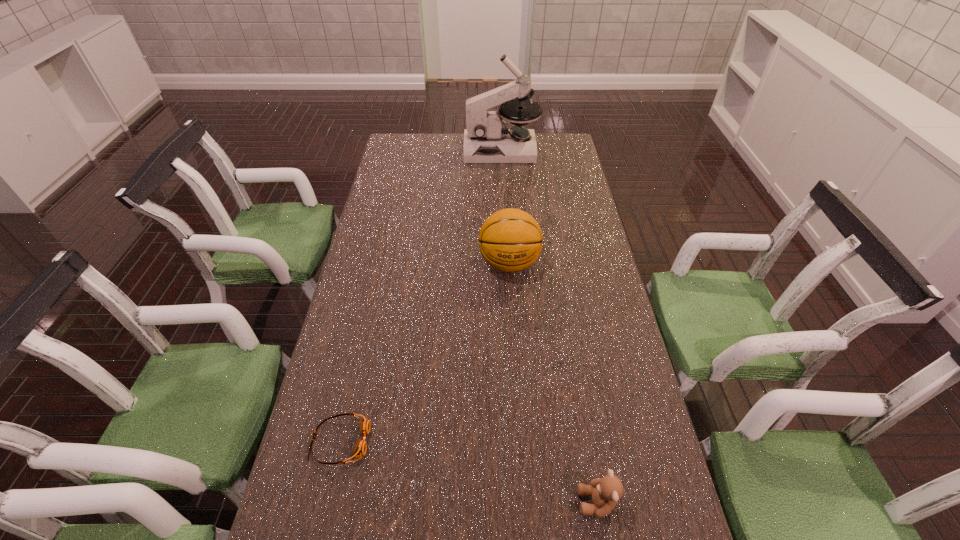
Locate an element on the screen. The height and width of the screenshot is (540, 960). vacant point located between the teddy bear and the tallest object is located at coordinates (549, 326).

Locate an element on the screen. The height and width of the screenshot is (540, 960). vacant space that is in between the third shortest object and the goggles is located at coordinates (424, 353).

What are the coordinates of `free space between the goggles and the tallest object` in the screenshot? It's located at click(420, 295).

This screenshot has height=540, width=960. Identify the location of free space between the goggles and the third shortest object. (424, 353).

Where is `vacant area that lies between the third nearest object and the tallest object`? vacant area that lies between the third nearest object and the tallest object is located at coordinates (505, 207).

At what (x,y) coordinates should I click in order to perform the action: click on object that is the closest to the second shortest object. Please return your answer as a coordinate pair (x, y). This screenshot has width=960, height=540. Looking at the image, I should click on (359, 451).

Identify which object is the second closest to the nearest object. Please provide its 2D coordinates. Your answer should be formatted as a tuple, i.e. [(x, y)], where the tuple contains the x and y coordinates of a point satisfying the conditions above.

[(510, 240)]

Locate an element on the screen. free spot that satisfies the following two spatial constraints: 1. on the surface of the second farthest object near the brand logo; 2. with the lenses facing forward on the leftmost object is located at coordinates (520, 441).

Where is `vacant space that satisfies the following two spatial constraints: 1. on the surface of the basketball near the brand logo; 2. with the lenses facing forward on the goggles`? Image resolution: width=960 pixels, height=540 pixels. vacant space that satisfies the following two spatial constraints: 1. on the surface of the basketball near the brand logo; 2. with the lenses facing forward on the goggles is located at coordinates (520, 441).

The image size is (960, 540). I want to click on vacant space that satisfies the following two spatial constraints: 1. on the surface of the basketball near the brand logo; 2. with the lenses facing forward on the leftmost object, so click(x=520, y=441).